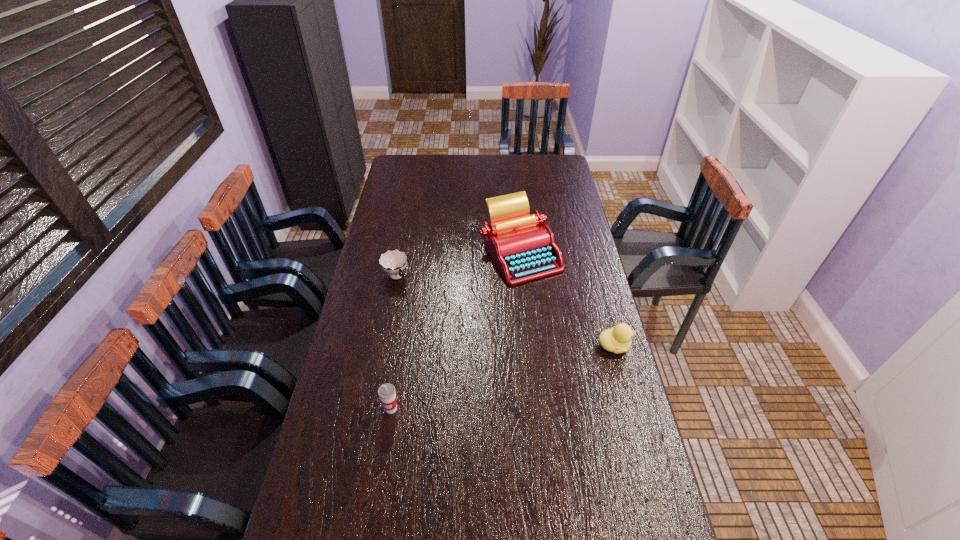
Find the location of a particular element. The width and height of the screenshot is (960, 540). the taller cup is located at coordinates (386, 392).

This screenshot has width=960, height=540. Find the location of `the nearer cup`. the nearer cup is located at coordinates (386, 392).

Identify the location of the third farthest object. (618, 339).

The height and width of the screenshot is (540, 960). I want to click on duckling, so click(x=618, y=339).

You are a GUI agent. You are given a task and a screenshot of the screen. Output one action in this format:
    pyautogui.click(x=<x>, y=<y>)
    Task: Click on the shorter cup
    
    Given the screenshot: What is the action you would take?
    coord(393,262)

Identify the location of typewriter. (522, 246).

You are a GUI agent. You are given a task and a screenshot of the screen. Output one action in this format:
    pyautogui.click(x=<x>, y=<y>)
    Task: Click on the tallest object
    
    Given the screenshot: What is the action you would take?
    [x=522, y=246]

Where is `free space located on the side of the nearest object with the logo`? Image resolution: width=960 pixels, height=540 pixels. free space located on the side of the nearest object with the logo is located at coordinates (381, 472).

The width and height of the screenshot is (960, 540). In order to click on vacant space located on the side of the farther cup with the handle in this screenshot , I will do `click(443, 332)`.

At what (x,y) coordinates should I click in order to perform the action: click on free space located 0.300m on the side of the farther cup with the handle. Please return your answer as a coordinate pair (x, y). Looking at the image, I should click on (445, 335).